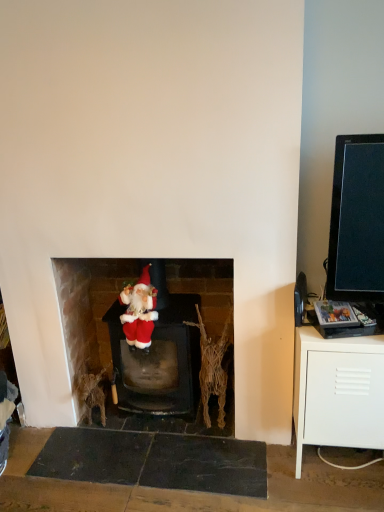
Where is `fuzzy fabric santa at center`? fuzzy fabric santa at center is located at coordinates (139, 311).

Does velvet santa at center have a lesser height compared to white matte cabinet at right?

Incorrect, the height of velvet santa at center does not fall short of that of white matte cabinet at right.

From the image's perspective, is velvet santa at center above or below white matte cabinet at right?

Clearly, from the image's perspective, velvet santa at center is above white matte cabinet at right.

Which object is closer to the camera, velvet santa at center or white matte cabinet at right?

white matte cabinet at right is more forward.

Can you confirm if velvet santa at center is wider than white matte cabinet at right?

Incorrect, the width of velvet santa at center does not surpass that of white matte cabinet at right.

From a real-world perspective, who is located lower, fuzzy fabric santa at center or white matte cabinet at right?

In real-world perspective, white matte cabinet at right is lower.

Do you think fuzzy fabric santa at center is within white matte cabinet at right, or outside of it?

fuzzy fabric santa at center exists outside the volume of white matte cabinet at right.

Is fuzzy fabric santa at center placed right next to white matte cabinet at right?

fuzzy fabric santa at center and white matte cabinet at right are clearly separated.

Based on the photo, is fuzzy fabric santa at center to the right of white matte cabinet at right from the viewer's perspective?

No, fuzzy fabric santa at center is not to the right of white matte cabinet at right.

Looking at this image, from the image's perspective, relative to fuzzy fabric santa at center, is white matte cabinet at right above or below?

white matte cabinet at right is situated lower than fuzzy fabric santa at center in the image.

Would you say white matte cabinet at right is a long distance from fuzzy fabric santa at center?

No, white matte cabinet at right is not far away from fuzzy fabric santa at center.

Which of these two, white matte cabinet at right or fuzzy fabric santa at center, is wider?

With larger width is white matte cabinet at right.

Which is in front, white matte cabinet at right or fuzzy fabric santa at center?

white matte cabinet at right is closer to the camera.

Consider the image. Considering the positions of objects velvet santa at center and fuzzy fabric santa at center in the image provided, who is in front, velvet santa at center or fuzzy fabric santa at center?

fuzzy fabric santa at center is closer to the camera.

Is velvet santa at center not inside fuzzy fabric santa at center?

→ Yes, velvet santa at center is not within fuzzy fabric santa at center.

Is velvet santa at center positioned with its back to fuzzy fabric santa at center?

Absolutely, velvet santa at center is directed away from fuzzy fabric santa at center.

Considering the positions of points (146, 270) and (63, 293), is point (146, 270) farther from camera compared to point (63, 293)?

No, (146, 270) is in front of (63, 293).

Based on the photo, between fuzzy fabric santa at center and velvet santa at center, which one has larger width?

velvet santa at center.

Considering their positions, is fuzzy fabric santa at center located in front of or behind velvet santa at center?

Visually, fuzzy fabric santa at center is located in front of velvet santa at center.

Which is closer to the camera, (347, 342) or (107, 338)?

Point (347, 342) is closer to the camera than point (107, 338).

Looking at this image, is white matte cabinet at right facing away from velvet santa at center?

No, white matte cabinet at right's orientation is not away from velvet santa at center.

Would you say white matte cabinet at right contains velvet santa at center?

No, velvet santa at center is not inside white matte cabinet at right.

Where is `table below the velvet santa at center (from a real-world perspective)`? table below the velvet santa at center (from a real-world perspective) is located at coordinates tap(338, 392).

Where is `table lying in front of the fuzzy fabric santa at center`? The height and width of the screenshot is (512, 384). table lying in front of the fuzzy fabric santa at center is located at coordinates (338, 392).

Based on their spatial positions, is fuzzy fabric santa at center or white matte cabinet at right closer to velvet santa at center?

fuzzy fabric santa at center is closer to velvet santa at center.

Which object lies further to the anchor point white matte cabinet at right, fuzzy fabric santa at center or velvet santa at center?

Based on the image, fuzzy fabric santa at center appears to be further to white matte cabinet at right.

Based on their spatial positions, is velvet santa at center or white matte cabinet at right closer to fuzzy fabric santa at center?

velvet santa at center lies closer to fuzzy fabric santa at center than the other object.

Estimate the real-world distances between objects in this image. Which object is further from velvet santa at center, white matte cabinet at right or fuzzy fabric santa at center?

Among the two, white matte cabinet at right is located further to velvet santa at center.

From the image, which object appears to be farther from fuzzy fabric santa at center, white matte cabinet at right or velvet santa at center?

white matte cabinet at right.

Looking at the image, which one is located closer to white matte cabinet at right, velvet santa at center or fuzzy fabric santa at center?

velvet santa at center is positioned closer to the anchor white matte cabinet at right.

Where is `fireplace between fuzzy fabric santa at center and white matte cabinet at right from left to right`? fireplace between fuzzy fabric santa at center and white matte cabinet at right from left to right is located at coordinates (153, 332).